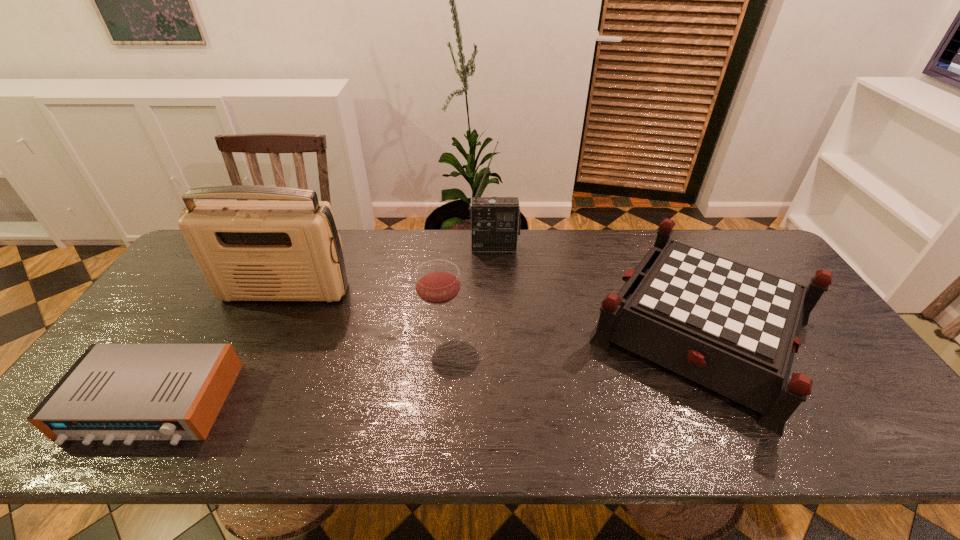
Where is `vacant space in between the second nearest radio receiver and the rightmost object`? The width and height of the screenshot is (960, 540). vacant space in between the second nearest radio receiver and the rightmost object is located at coordinates (494, 310).

Find the location of a particular element. This screenshot has width=960, height=540. free space that is in between the farthest radio receiver and the shortest object is located at coordinates click(x=324, y=325).

What are the coordinates of `free space between the rightmost object and the farthest object` in the screenshot? It's located at (599, 288).

The height and width of the screenshot is (540, 960). I want to click on free spot between the rightmost radio receiver and the wineglass, so click(468, 288).

Identify the location of free space that is in between the rightmost radio receiver and the rightmost object. (x=599, y=288).

Where is `vacant area that lies between the farthest object and the third object from right to left`? vacant area that lies between the farthest object and the third object from right to left is located at coordinates (468, 288).

Locate an element on the screen. This screenshot has width=960, height=540. object identified as the third closest to the shortest radio receiver is located at coordinates (495, 221).

This screenshot has height=540, width=960. Identify the location of the fourth closest object to the shortest object. (734, 329).

Select which radio receiver appears as the second closest to the farthest object. Please provide its 2D coordinates. Your answer should be formatted as a tuple, i.e. [(x, y)], where the tuple contains the x and y coordinates of a point satisfying the conditions above.

[(128, 392)]

Identify the location of the closest radio receiver to the shortest radio receiver. Image resolution: width=960 pixels, height=540 pixels. coord(290,250).